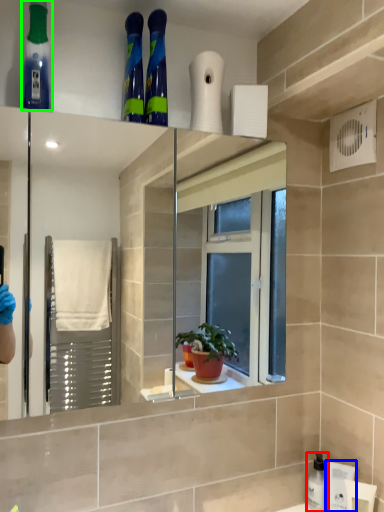
Question: Which object is positioned closest to cleaning product (highlighted by a red box)? Select from toiletry (highlighted by a blue box) and mouthwash (highlighted by a green box).

Choices:
 (A) toiletry
 (B) mouthwash

Answer: (A)